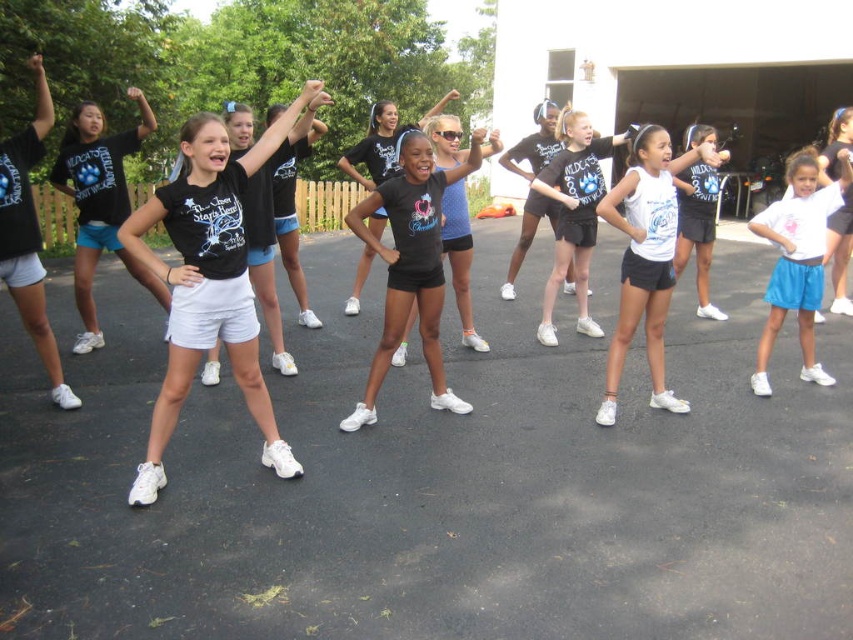
Question: Which object is farther from the camera taking this photo?

Choices:
 (A) black matte shorts at center
 (B) white matte shorts at lower right
 (C) black matte t-shirt at center
 (D) white matte shorts at center

Answer: (B)

Question: Which point is closer to the camera?

Choices:
 (A) (779, 323)
 (B) (651, 317)
 (C) (838, 173)
 (D) (96, 198)

Answer: (B)

Question: Is black matte t-shirt at center positioned behind white matte shorts at lower right?

Choices:
 (A) no
 (B) yes

Answer: (A)

Question: Does white matte shorts at center appear over white matte shorts at lower right?

Choices:
 (A) yes
 (B) no

Answer: (B)

Question: Is white cotton shirt at center above white matte shorts at center?

Choices:
 (A) no
 (B) yes

Answer: (A)

Question: Estimate the real-world distances between objects in this image. Which object is farther from the white matte shorts at center?

Choices:
 (A) white matte shorts at lower right
 (B) black matte shorts at center
 (C) white cotton shirt at center

Answer: (B)